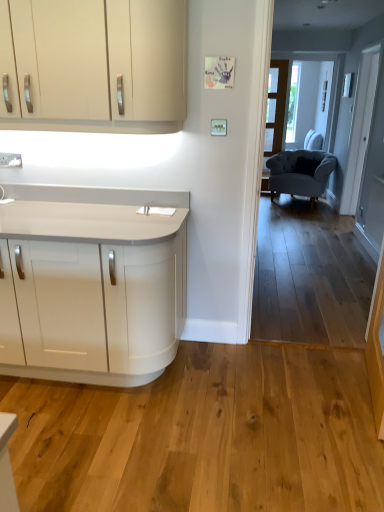
Question: Should I look upward or downward to see velvet grey armchair at right?

Choices:
 (A) up
 (B) down

Answer: (A)

Question: Is clear glass door at center at the right side of velvet grey armchair at right?

Choices:
 (A) yes
 (B) no

Answer: (B)

Question: Is clear glass door at center bigger than velvet grey armchair at right?

Choices:
 (A) no
 (B) yes

Answer: (A)

Question: Considering the relative positions of clear glass door at center and velvet grey armchair at right in the image provided, is clear glass door at center to the left of velvet grey armchair at right from the viewer's perspective?

Choices:
 (A) yes
 (B) no

Answer: (A)

Question: Is clear glass door at center oriented towards velvet grey armchair at right?

Choices:
 (A) no
 (B) yes

Answer: (A)

Question: From the image's perspective, is clear glass door at center below velvet grey armchair at right?

Choices:
 (A) yes
 (B) no

Answer: (B)

Question: From a real-world perspective, is clear glass door at center over velvet grey armchair at right?

Choices:
 (A) yes
 (B) no

Answer: (A)

Question: Is the surface of white glossy countertop at lower left in direct contact with clear glass door at center?

Choices:
 (A) no
 (B) yes

Answer: (A)

Question: Is white glossy countertop at lower left thinner than clear glass door at center?

Choices:
 (A) no
 (B) yes

Answer: (A)

Question: Is white glossy countertop at lower left positioned beyond the bounds of clear glass door at center?

Choices:
 (A) no
 (B) yes

Answer: (B)

Question: Is white glossy countertop at lower left further to camera compared to clear glass door at center?

Choices:
 (A) yes
 (B) no

Answer: (B)

Question: From the image's perspective, does white glossy countertop at lower left appear lower than clear glass door at center?

Choices:
 (A) no
 (B) yes

Answer: (B)

Question: Does white glossy countertop at lower left have a greater width compared to clear glass door at center?

Choices:
 (A) no
 (B) yes

Answer: (B)

Question: Can you confirm if white glossy countertop at lower left is positioned to the left of velvet grey armchair at right?

Choices:
 (A) no
 (B) yes

Answer: (B)